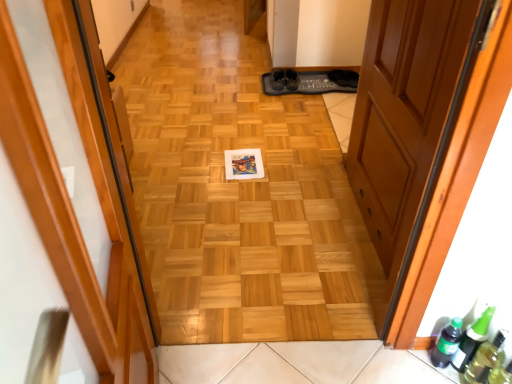
Locate an element on the screen. free space to the left of green matte bottle at lower right, which appears as the second beer bottle when viewed from the right is located at coordinates (393, 364).